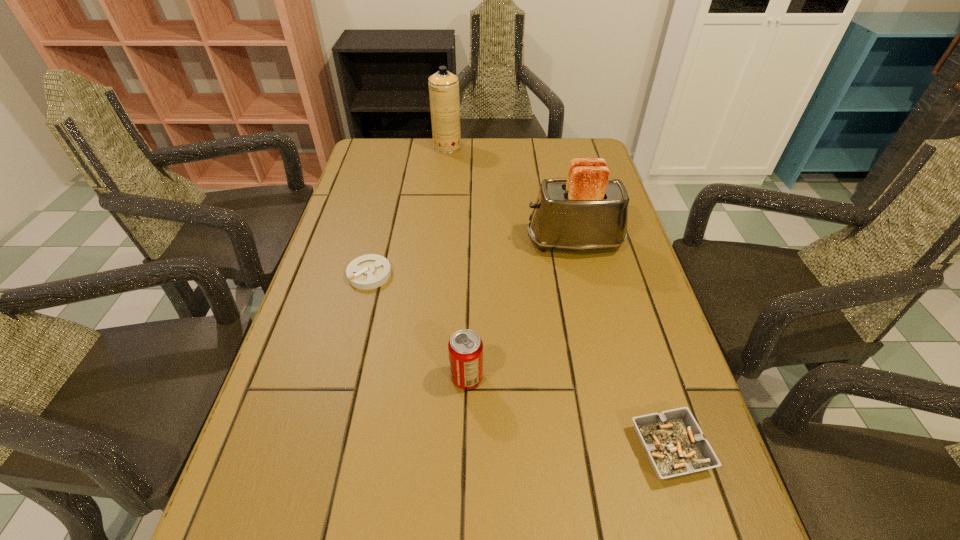
What are the coordinates of `vacant area located on the side of the toaster with the control lever` in the screenshot? It's located at point(481,242).

This screenshot has height=540, width=960. I want to click on vacant region located on the side of the toaster with the control lever, so click(458, 242).

Find the location of a particular element. The image size is (960, 540). vacant space situated on the side of the toaster with the control lever is located at coordinates (432, 242).

Where is `vacant area situated 0.350m on the left of the soda can`? The width and height of the screenshot is (960, 540). vacant area situated 0.350m on the left of the soda can is located at coordinates [x=276, y=377].

The image size is (960, 540). I want to click on vacant space located on the back of the nearer ashtray, so click(619, 285).

Identify the location of vacant space located 0.360m on the right of the left ashtray. The height and width of the screenshot is (540, 960). (537, 274).

I want to click on object located in the far edge section of the desktop, so (443, 86).

The width and height of the screenshot is (960, 540). I want to click on object situated at the left edge, so click(x=370, y=271).

Locate an element on the screen. The height and width of the screenshot is (540, 960). toaster that is at the right edge is located at coordinates (587, 211).

The height and width of the screenshot is (540, 960). What are the coordinates of `ashtray located at the right edge` in the screenshot? It's located at (673, 441).